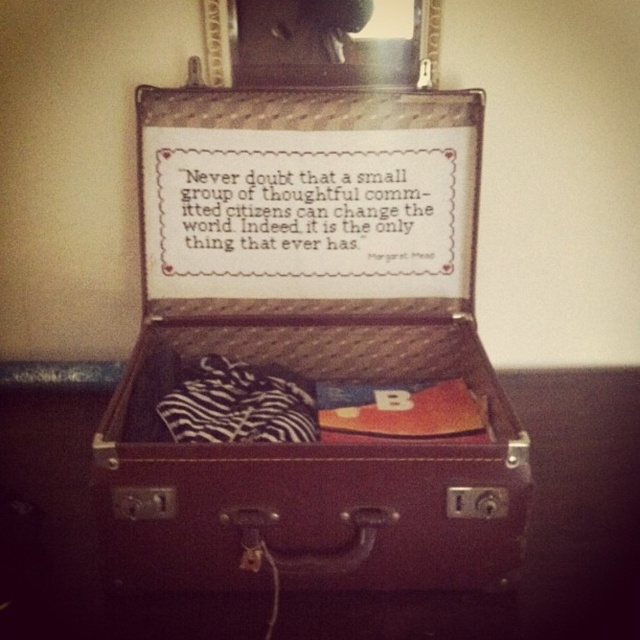
Who is positioned more to the left, leather suitcase at center or zebra-patterned fabric at center?

zebra-patterned fabric at center is more to the left.

Between leather suitcase at center and zebra-patterned fabric at center, which one has more height?

leather suitcase at center

Is point (435, 296) positioned behind point (196, 388)?

That is True.

Find the location of a particular element. Image resolution: width=640 pixels, height=640 pixels. leather suitcase at center is located at coordinates (308, 352).

Who is lower down, leather suitcase at center or metallic mirror at upper center?

Positioned lower is leather suitcase at center.

This screenshot has width=640, height=640. What do you see at coordinates (308, 352) in the screenshot? I see `leather suitcase at center` at bounding box center [308, 352].

Identify the location of leather suitcase at center. Image resolution: width=640 pixels, height=640 pixels. (308, 352).

Who is more distant from viewer, (x=328, y=22) or (x=176, y=385)?

Positioned behind is point (x=176, y=385).

Looking at this image, is metallic mirror at upper center taller than zebra-patterned fabric at center?

Yes.

Measure the distance between metallic mirror at upper center and camera.

metallic mirror at upper center is 1.18 meters from camera.

What are the coordinates of `metallic mirror at upper center` in the screenshot? It's located at (321, 42).